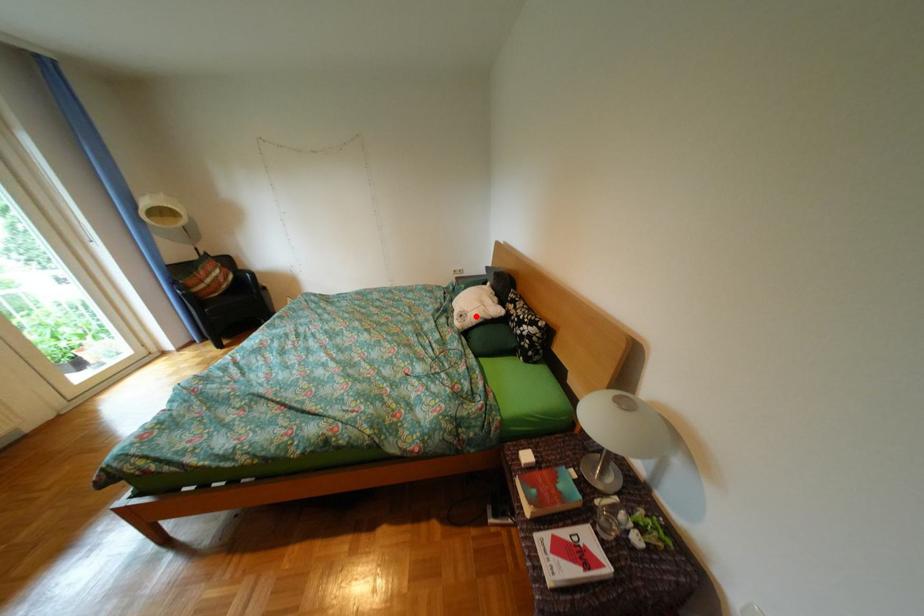
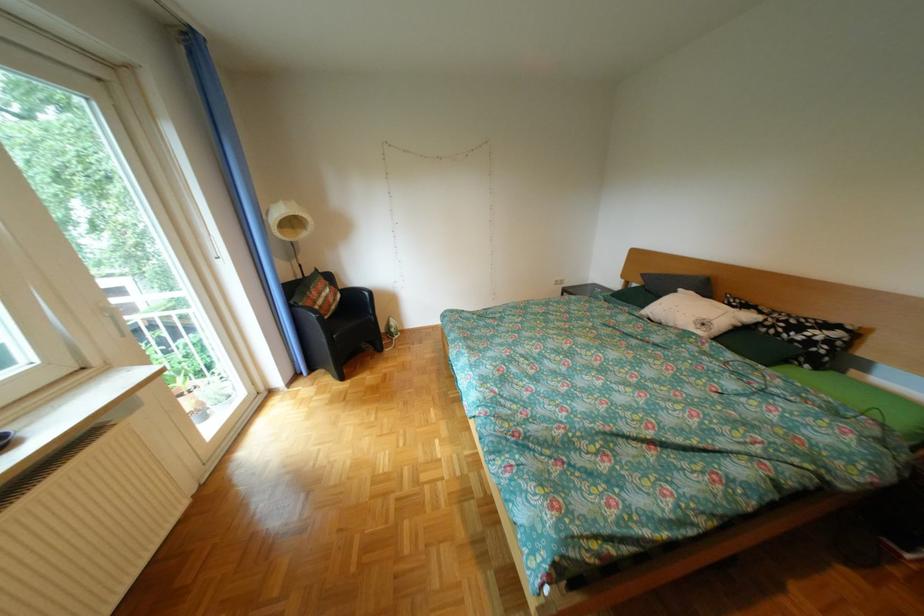
In the second image, find the point that corresponds to the highlighted location in the first image.

(718, 325)